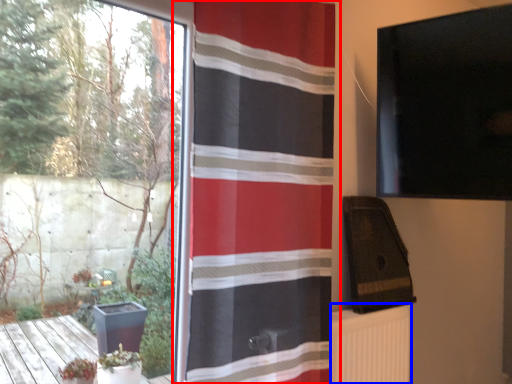
Question: Which of the following is the farthest to the observer, curtain (highlighted by a red box) or radiator (highlighted by a blue box)?

Choices:
 (A) curtain
 (B) radiator

Answer: (B)